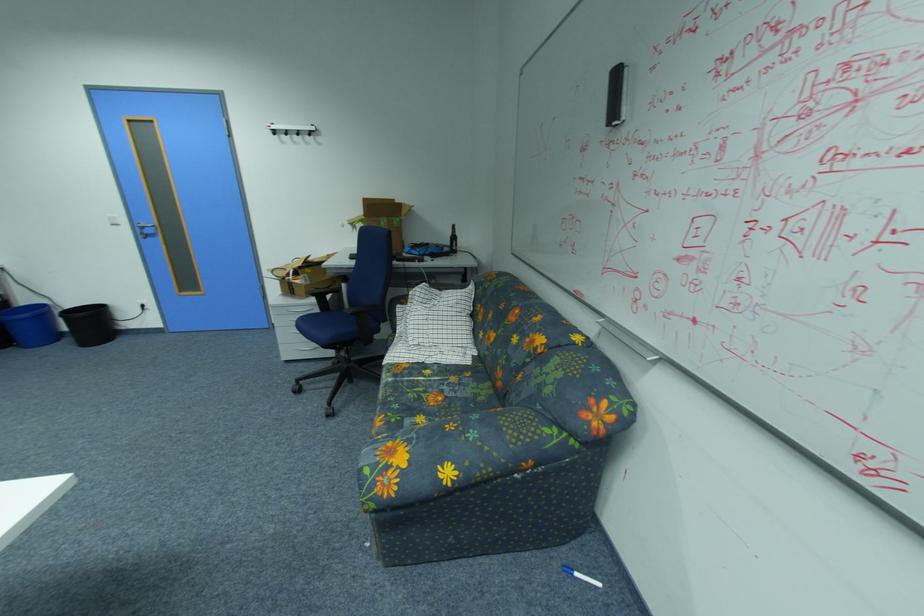
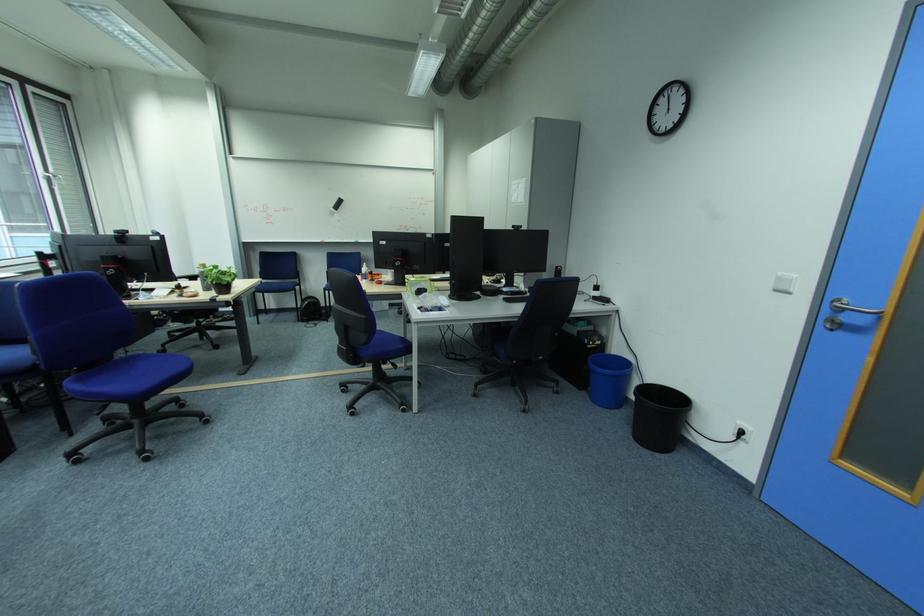
In the second image, find the point that corresponds to point 89,350 in the first image.

(640, 439)